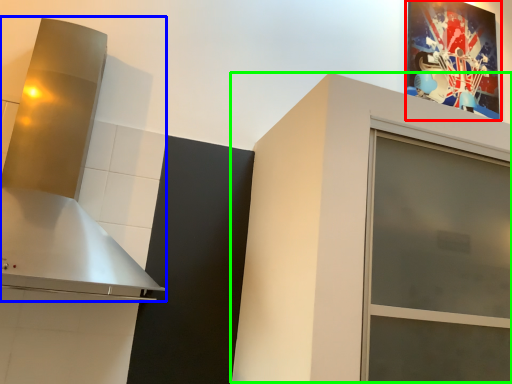
Question: Estimate the real-world distances between objects in this image. Which object is farther from picture frame (highlighted by a red box), vent (highlighted by a blue box) or cabinetry (highlighted by a green box)?

Choices:
 (A) vent
 (B) cabinetry

Answer: (A)